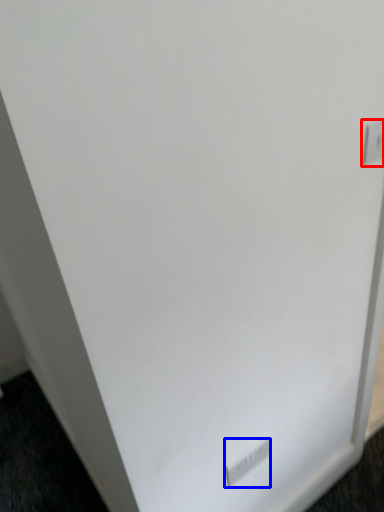
Question: Which point is closer to the camera, electric outlet (highlighted by a red box) or electric outlet (highlighted by a blue box)?

Choices:
 (A) electric outlet
 (B) electric outlet

Answer: (A)